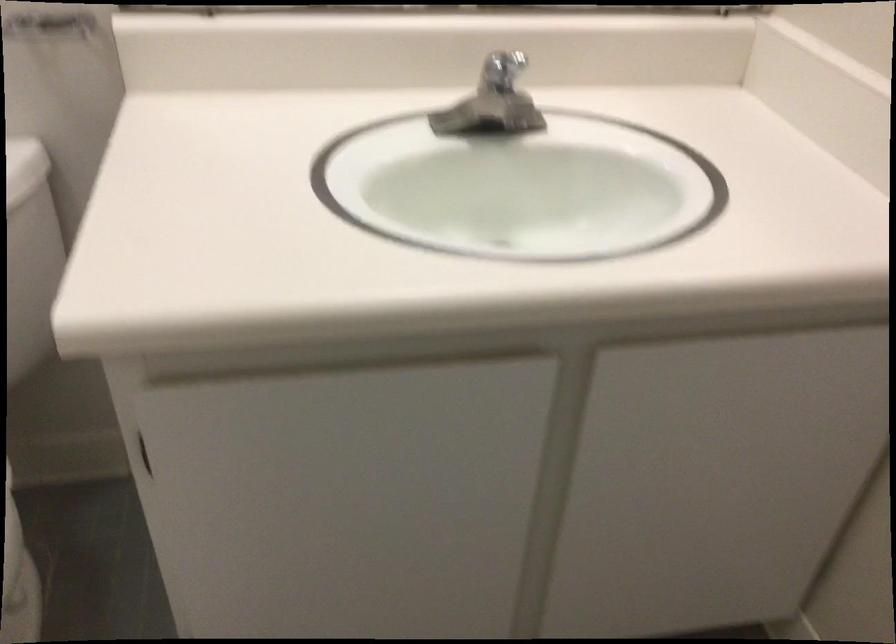
At what (x,y) coordinates should I click in order to perform the action: click on cabinet door pull. Please return your answer as a coordinate pair (x, y). The image size is (896, 644). Looking at the image, I should click on (143, 453).